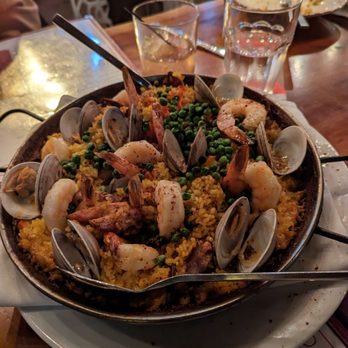
Where is `handles`? handles is located at coordinates (329, 159), (34, 115).